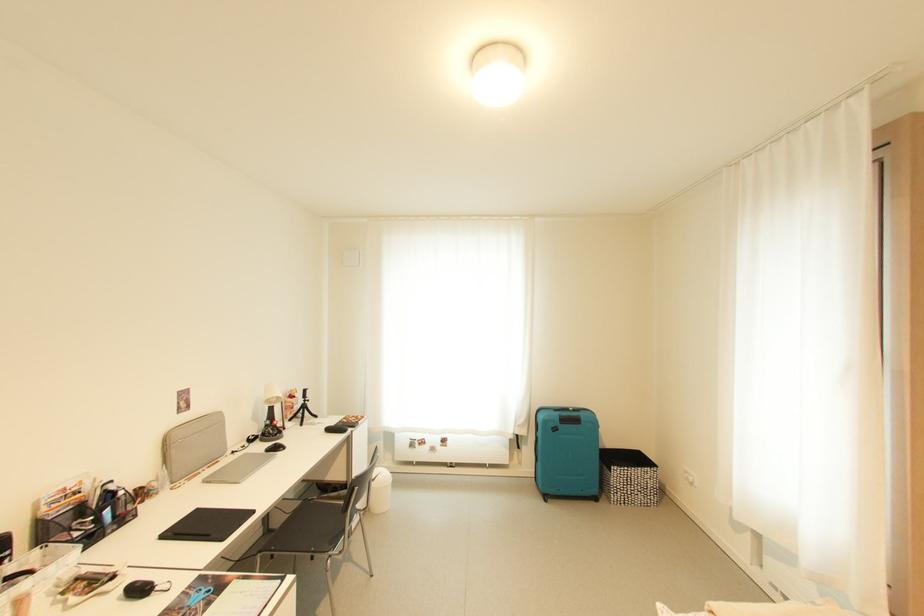
Image resolution: width=924 pixels, height=616 pixels. Describe the element at coordinates (567, 408) in the screenshot. I see `a suitcase handle` at that location.